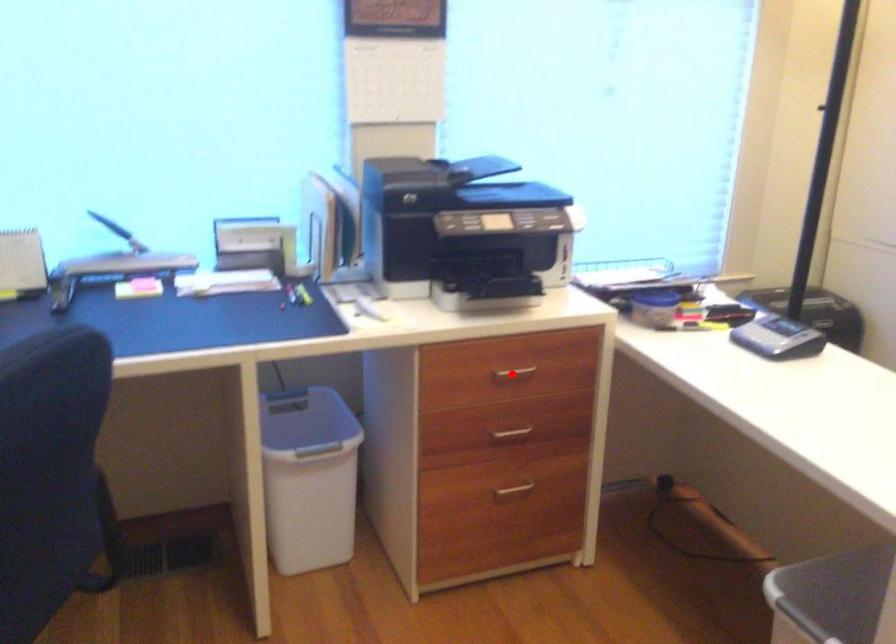
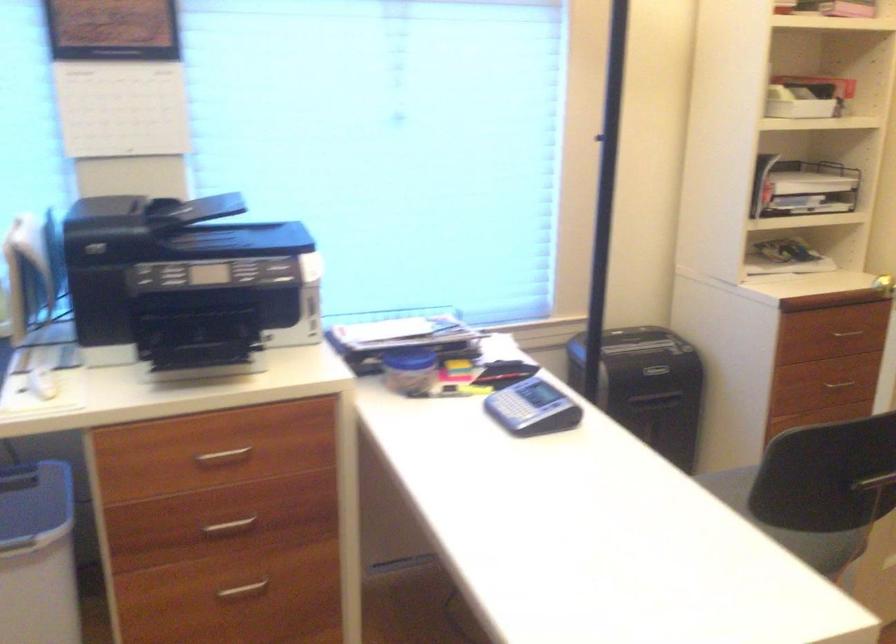
Question: I am providing you with two images of the same scene from different viewpoints. Given a red point in image1, look at the same physical point in image2. Is it:

Choices:
 (A) Closer to the viewpoint
 (B) Farther from the viewpoint

Answer: (A)